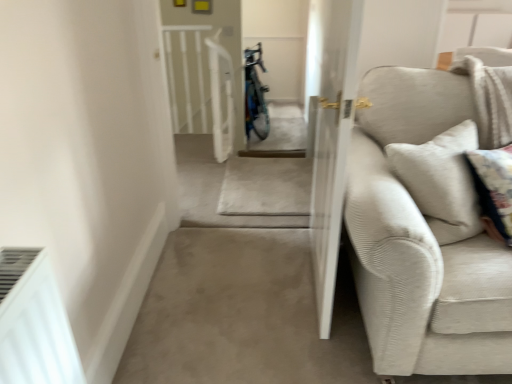
Locate an element on the screen. The image size is (512, 384). free space on the front side of white textured screen door at center is located at coordinates (308, 338).